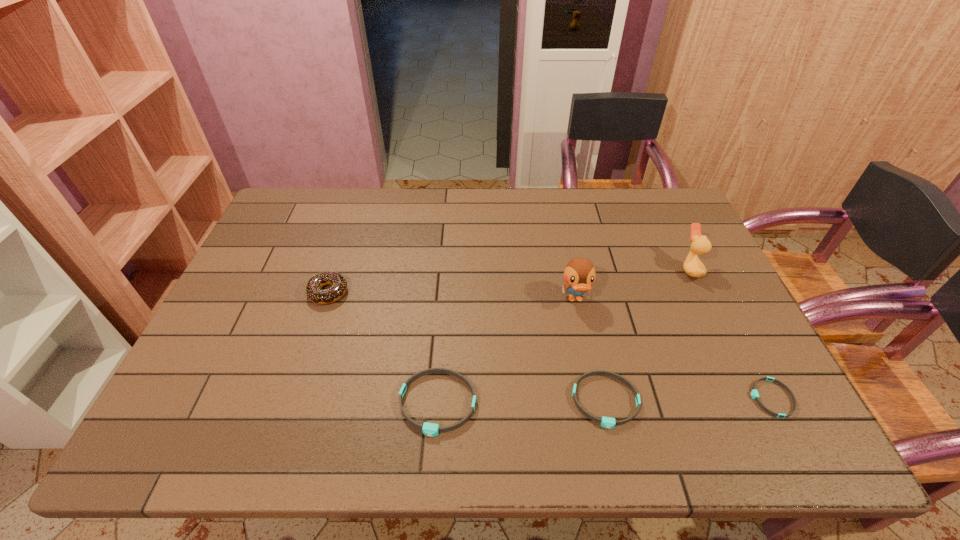
Please point a free position for a wristband on the left. Please provide its 2D coordinates. Your answer should be formatted as a tuple, i.e. [(x, y)], where the tuple contains the x and y coordinates of a point satisfying the conditions above.

[(268, 406)]